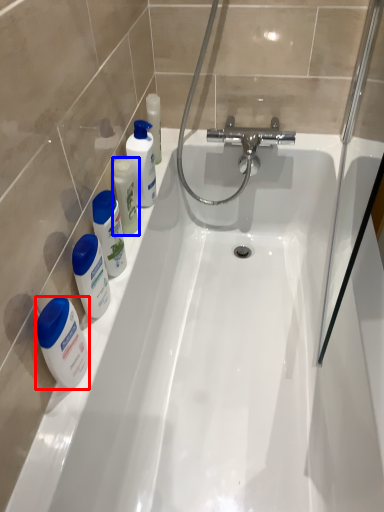
Question: Which of the following is the closest to the observer, mouthwash (highlighted by a red box) or mouthwash (highlighted by a blue box)?

Choices:
 (A) mouthwash
 (B) mouthwash

Answer: (A)